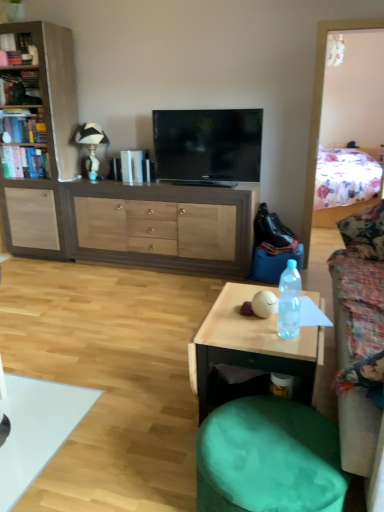
Find the location of a particular element. Image resolution: width=384 pixels, height=512 pixels. vacant space situated on the left part of clear plastic bottle at center is located at coordinates (249, 330).